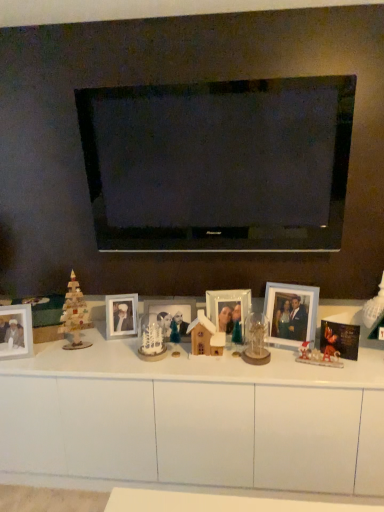
You are a GUI agent. You are given a task and a screenshot of the screen. Output one action in this format:
    pyautogui.click(x=<x>, y=<y>)
    Task: Click on the unoccupied region to the right of metallic gold ornament at center-right, positioned as the 3th toy in left-to-right order
    Image resolution: width=384 pixels, height=512 pixels.
    Given the screenshot: What is the action you would take?
    pyautogui.click(x=354, y=362)